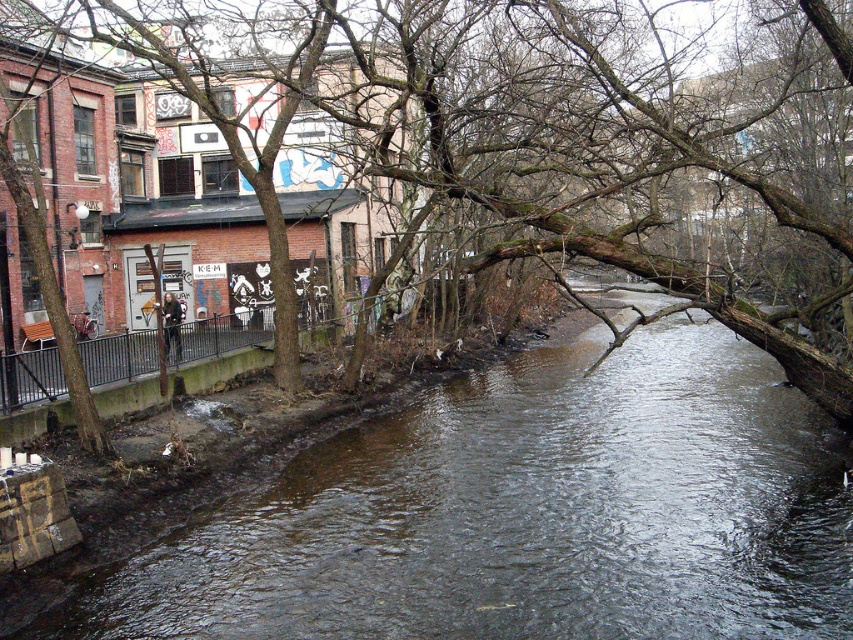
You are standing at the point marked by the coordinate (527,513) in the image. What type of surface are you standing on?

You are standing on a brown rough concrete stream located at point (527,513).